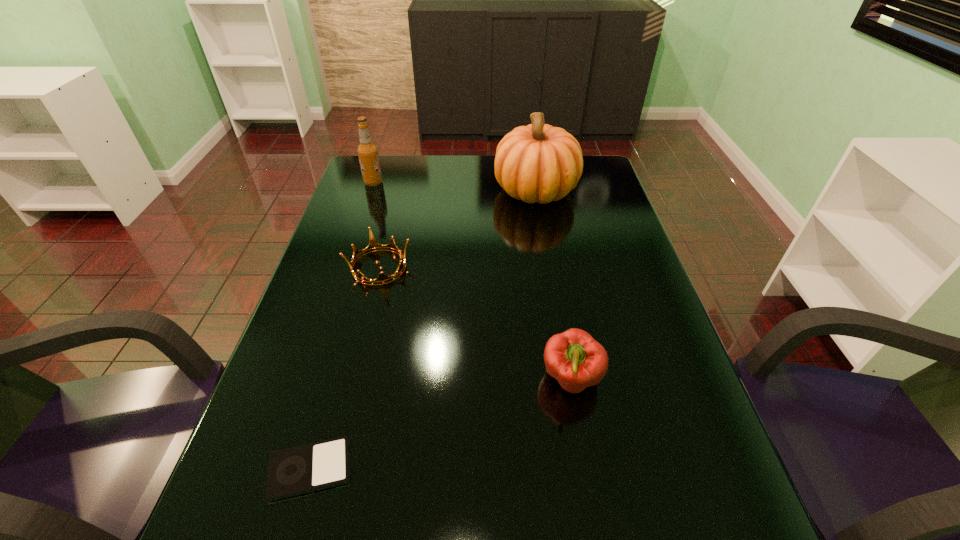
Find the location of a particular element. Image resolution: width=960 pixels, height=540 pixels. object at the far right corner is located at coordinates (540, 163).

Find the location of a particular element. This screenshot has width=960, height=540. vacant space at the far edge is located at coordinates (467, 180).

In the image, there is a desktop. In order to click on free region at the left edge in this screenshot , I will do (347, 294).

You are a GUI agent. You are given a task and a screenshot of the screen. Output one action in this format:
    pyautogui.click(x=<x>, y=<y>)
    Task: Click on the blank space at the right edge of the desktop
    
    Given the screenshot: What is the action you would take?
    pos(678,398)

This screenshot has height=540, width=960. Find the location of `free space at the far right corner of the desktop`. free space at the far right corner of the desktop is located at coordinates (590, 167).

This screenshot has height=540, width=960. In order to click on empty space between the pumpkin and the beer bottle in this screenshot , I will do [x=455, y=187].

The image size is (960, 540). Find the location of `free area in between the pumpkin and the second shortest object`. free area in between the pumpkin and the second shortest object is located at coordinates (457, 228).

The width and height of the screenshot is (960, 540). I want to click on vacant space that's between the bell pepper and the pumpkin, so click(x=554, y=285).

This screenshot has height=540, width=960. What are the coordinates of `free spot between the third farthest object and the bell pepper` in the screenshot? It's located at (475, 323).

The height and width of the screenshot is (540, 960). I want to click on empty space that is in between the fourth tallest object and the iPod, so click(x=345, y=368).